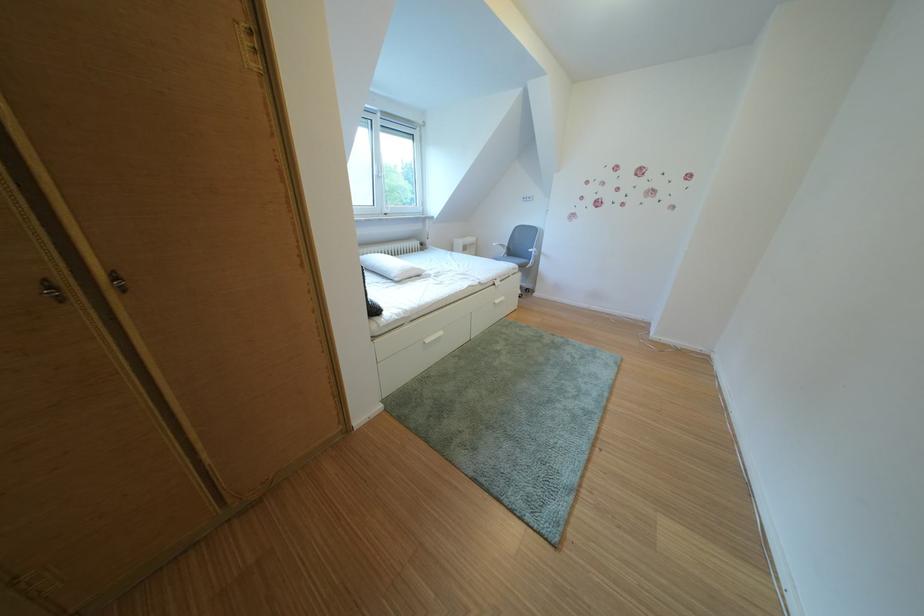
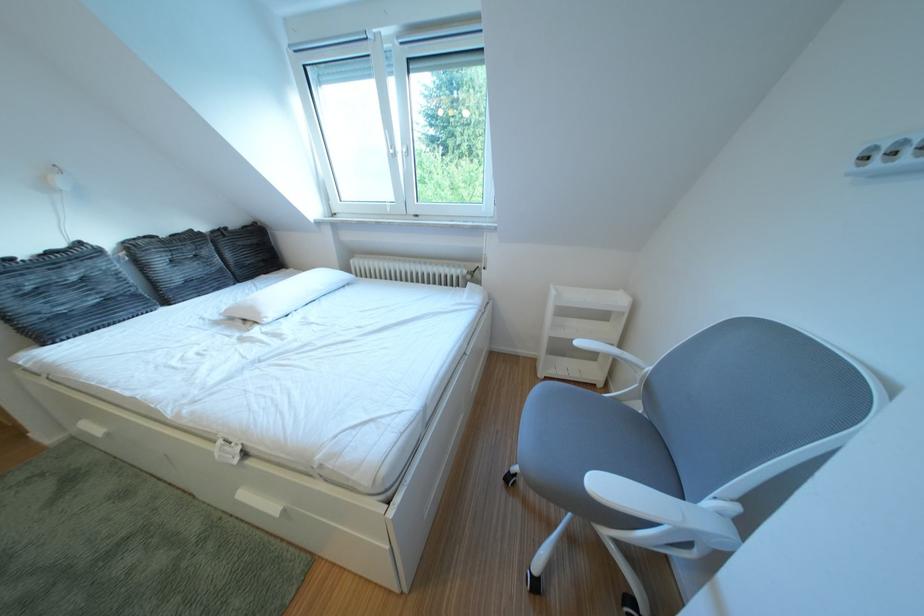
Where in the second image is the point corresponding to point (433, 275) from the first image?

(273, 318)